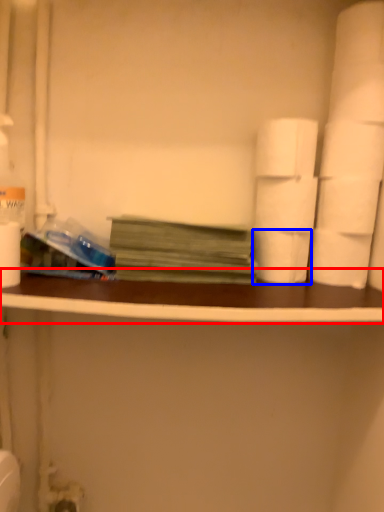
Question: Which of the following is the farthest to the observer, ledge (highlighted by a red box) or toilet paper (highlighted by a blue box)?

Choices:
 (A) ledge
 (B) toilet paper

Answer: (B)